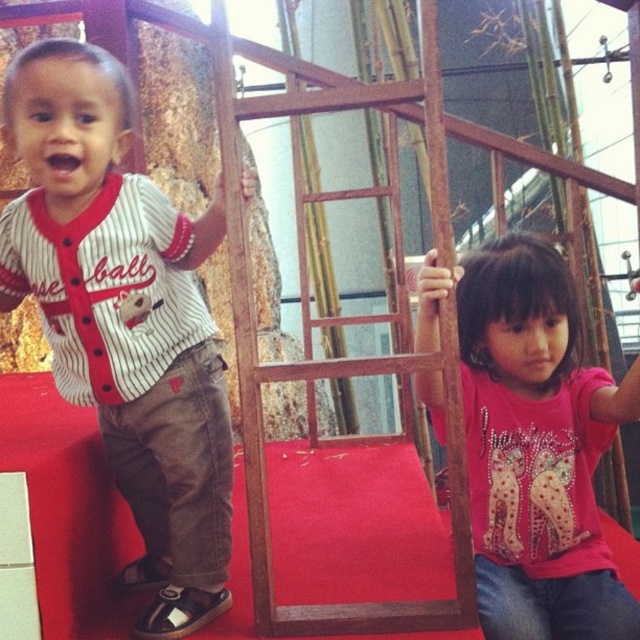
Does white striped jersey at left appear on the left side of pink glittery shirt at center?

Correct, you'll find white striped jersey at left to the left of pink glittery shirt at center.

Is point (81, 42) closer to camera compared to point (586, 410)?

That is True.

Which is behind, point (109, 298) or point (548, 582)?

Positioned behind is point (548, 582).

What are the coordinates of `white striped jersey at left` in the screenshot? It's located at (124, 317).